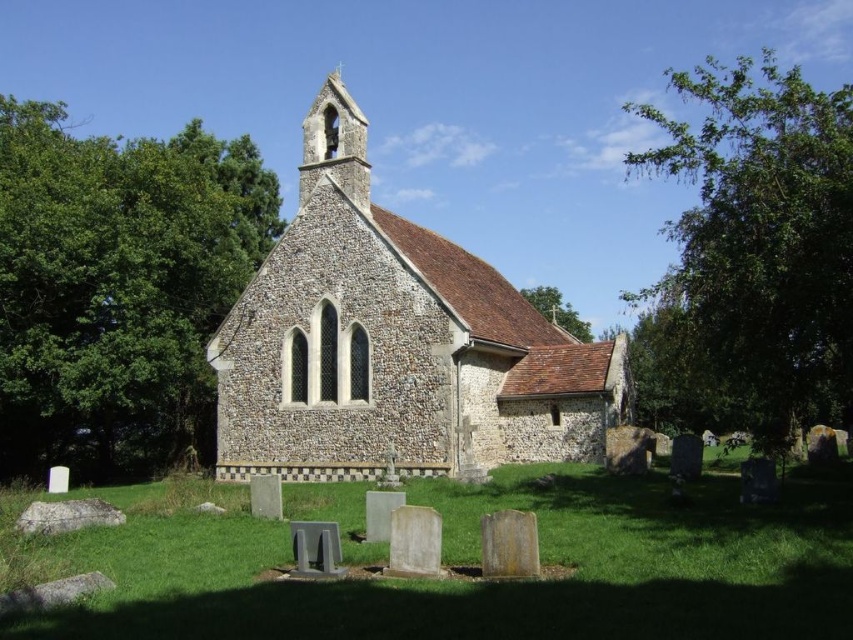
Who is shorter, brown stone church at center or green leafy tree at upper right?

With less height is brown stone church at center.

How much distance is there between brown stone church at center and green leafy tree at upper right?

They are 95.81 feet apart.

Is point (488, 352) positioned after point (699, 202)?

No, it is in front of (699, 202).

This screenshot has height=640, width=853. I want to click on brown stone church at center, so click(x=393, y=342).

Which is above, green leafy tree at upper left or green leafy tree at upper right?

green leafy tree at upper left

From the picture: Does green leafy tree at upper left have a lesser height compared to green leafy tree at upper right?

Correct, green leafy tree at upper left is not as tall as green leafy tree at upper right.

Who is more distant from viewer, (231, 236) or (793, 305)?

The point (231, 236) is more distant.

The width and height of the screenshot is (853, 640). Find the location of `green leafy tree at upper left`. green leafy tree at upper left is located at coordinates (119, 289).

Is brown stone church at center positioned in front of green leafy tree at upper left?

Yes, it is in front of green leafy tree at upper left.

This screenshot has height=640, width=853. What do you see at coordinates (393, 342) in the screenshot?
I see `brown stone church at center` at bounding box center [393, 342].

The image size is (853, 640). What do you see at coordinates (393, 342) in the screenshot?
I see `brown stone church at center` at bounding box center [393, 342].

You are a GUI agent. You are given a task and a screenshot of the screen. Output one action in this format:
    pyautogui.click(x=<x>, y=<y>)
    Task: Click on the brown stone church at center
    
    Given the screenshot: What is the action you would take?
    pyautogui.click(x=393, y=342)